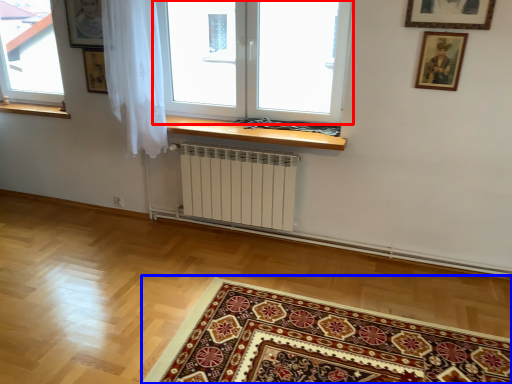
Question: Which point is further to the camera, window (highlighted by a red box) or mat (highlighted by a blue box)?

Choices:
 (A) window
 (B) mat

Answer: (A)